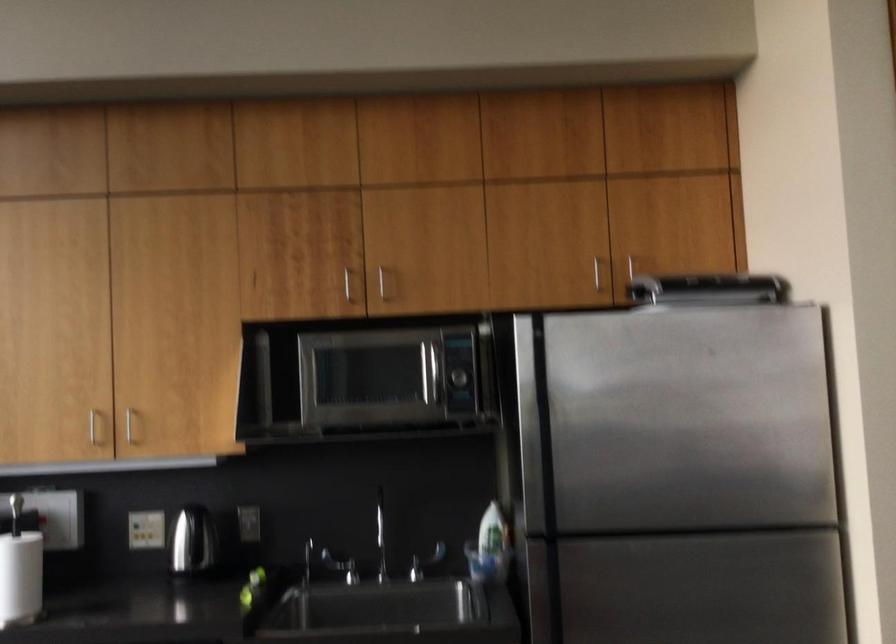
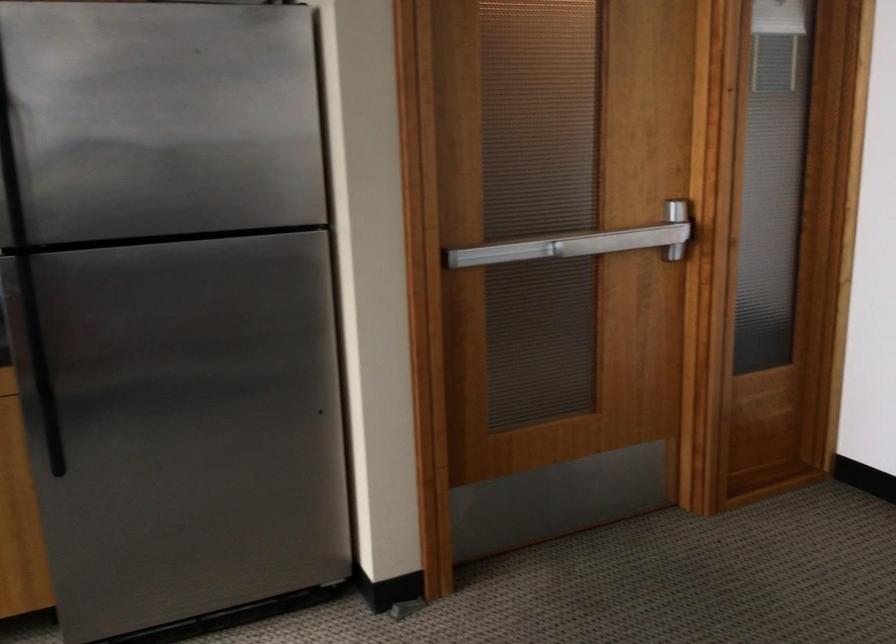
Based on the continuous images, in which direction is the camera rotating?

The camera rotated toward right-down.